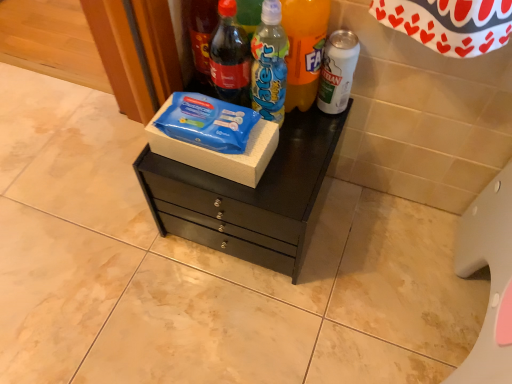
Question: Should I look upward or downward to see blue plastic bottle at center, positioned as the third bottle in right-to-left order?

Choices:
 (A) up
 (B) down

Answer: (A)

Question: Which direction should I rotate to look at matte glass soda bottle at upper center, which appears as the 2th bottle when viewed from the left, — up or down?

Choices:
 (A) down
 (B) up

Answer: (B)

Question: Does matte glass soda bottle at upper left, which is the 5th bottle in right-to-left order, come behind translucent plastic water bottle at center, the second bottle viewed from the right?

Choices:
 (A) yes
 (B) no

Answer: (A)

Question: Considering the relative sizes of matte glass soda bottle at upper left, the first bottle in the left-to-right sequence, and translucent plastic water bottle at center, which ranks as the fourth bottle in left-to-right order, in the image provided, is matte glass soda bottle at upper left, the first bottle in the left-to-right sequence, bigger than translucent plastic water bottle at center, which ranks as the fourth bottle in left-to-right order,?

Choices:
 (A) yes
 (B) no

Answer: (B)

Question: Does matte glass soda bottle at upper left, the first bottle in the left-to-right sequence, have a lesser width compared to translucent plastic water bottle at center, the second bottle viewed from the right?

Choices:
 (A) no
 (B) yes

Answer: (B)

Question: Does matte glass soda bottle at upper left, the first bottle in the left-to-right sequence, have a greater height compared to translucent plastic water bottle at center, the second bottle viewed from the right?

Choices:
 (A) yes
 (B) no

Answer: (A)

Question: Is matte glass soda bottle at upper left, the first bottle in the left-to-right sequence, outside of translucent plastic water bottle at center, which ranks as the fourth bottle in left-to-right order?

Choices:
 (A) yes
 (B) no

Answer: (A)

Question: Is matte glass soda bottle at upper left, which is the 5th bottle in right-to-left order, looking in the opposite direction of translucent plastic water bottle at center, which ranks as the fourth bottle in left-to-right order?

Choices:
 (A) yes
 (B) no

Answer: (B)

Question: Is black matte chest of drawers at center at the right side of matte glass soda bottle at upper left, the first bottle in the left-to-right sequence?

Choices:
 (A) no
 (B) yes

Answer: (B)

Question: From the image's perspective, is black matte chest of drawers at center on matte glass soda bottle at upper left, which is the 5th bottle in right-to-left order?

Choices:
 (A) no
 (B) yes

Answer: (A)

Question: Is there a large distance between black matte chest of drawers at center and matte glass soda bottle at upper left, which is the 5th bottle in right-to-left order?

Choices:
 (A) yes
 (B) no

Answer: (B)

Question: Can you confirm if black matte chest of drawers at center is shorter than matte glass soda bottle at upper left, the first bottle in the left-to-right sequence?

Choices:
 (A) no
 (B) yes

Answer: (B)

Question: Is black matte chest of drawers at center thinner than matte glass soda bottle at upper left, which is the 5th bottle in right-to-left order?

Choices:
 (A) yes
 (B) no

Answer: (B)

Question: Is black matte chest of drawers at center in front of matte glass soda bottle at upper left, which is the 5th bottle in right-to-left order?

Choices:
 (A) yes
 (B) no

Answer: (B)

Question: Considering the relative sizes of matte glass soda bottle at upper left, the first bottle in the left-to-right sequence, and black matte chest of drawers at center in the image provided, is matte glass soda bottle at upper left, the first bottle in the left-to-right sequence, smaller than black matte chest of drawers at center?

Choices:
 (A) no
 (B) yes

Answer: (B)